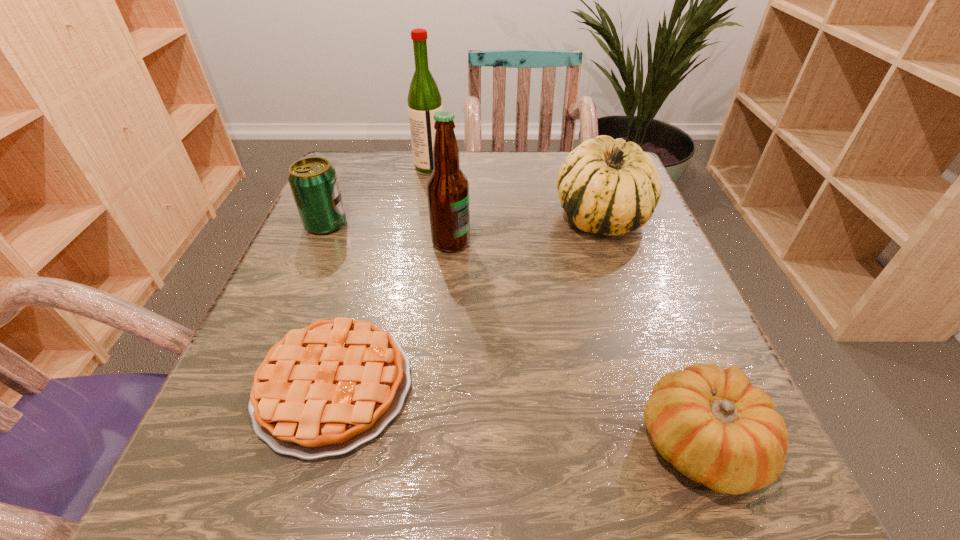
Identify the location of free spot located 0.230m on the label of the beer bottle. (588, 242).

Locate an element on the screen. free space located 0.280m on the front of the fourth shortest object is located at coordinates (655, 370).

The height and width of the screenshot is (540, 960). In order to click on free space located on the back of the beer can in this screenshot , I will do `click(342, 187)`.

Find the location of a particular element. This screenshot has height=540, width=960. free region located on the back of the nearer gourd is located at coordinates (625, 247).

Where is `free spot located on the back of the pie`? The height and width of the screenshot is (540, 960). free spot located on the back of the pie is located at coordinates (387, 197).

Find the location of `liquor that is at the far edge`. liquor that is at the far edge is located at coordinates click(x=424, y=100).

Image resolution: width=960 pixels, height=540 pixels. What are the coordinates of `gourd at the far edge` in the screenshot? It's located at (607, 186).

The width and height of the screenshot is (960, 540). In order to click on gourd at the near edge in this screenshot , I will do `click(715, 427)`.

You are a GUI agent. You are given a task and a screenshot of the screen. Output one action in this format:
    pyautogui.click(x=<x>, y=<y>)
    Task: Click on the pie located at the near edge
    
    Given the screenshot: What is the action you would take?
    pyautogui.click(x=323, y=390)

The height and width of the screenshot is (540, 960). Find the location of `beer can at the left edge`. beer can at the left edge is located at coordinates (313, 181).